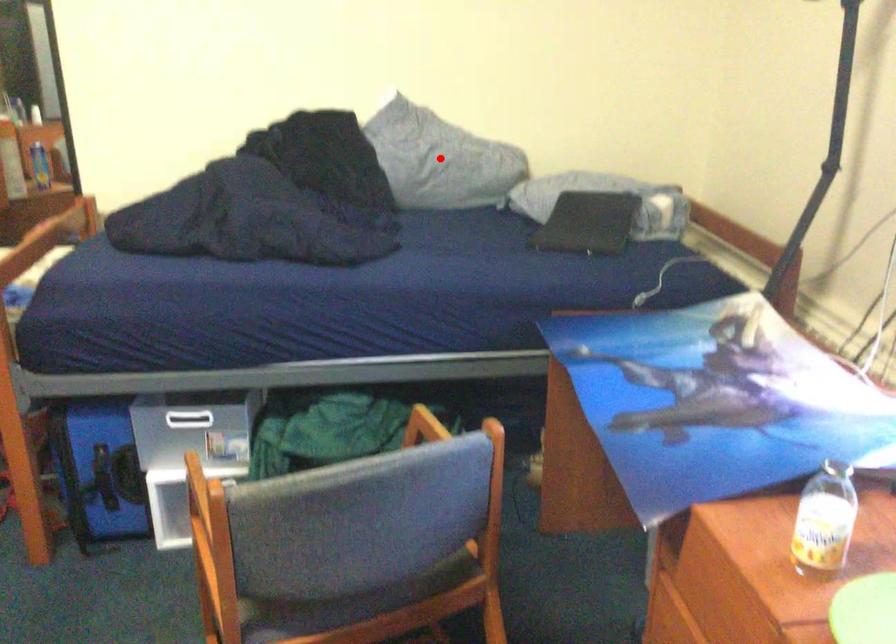
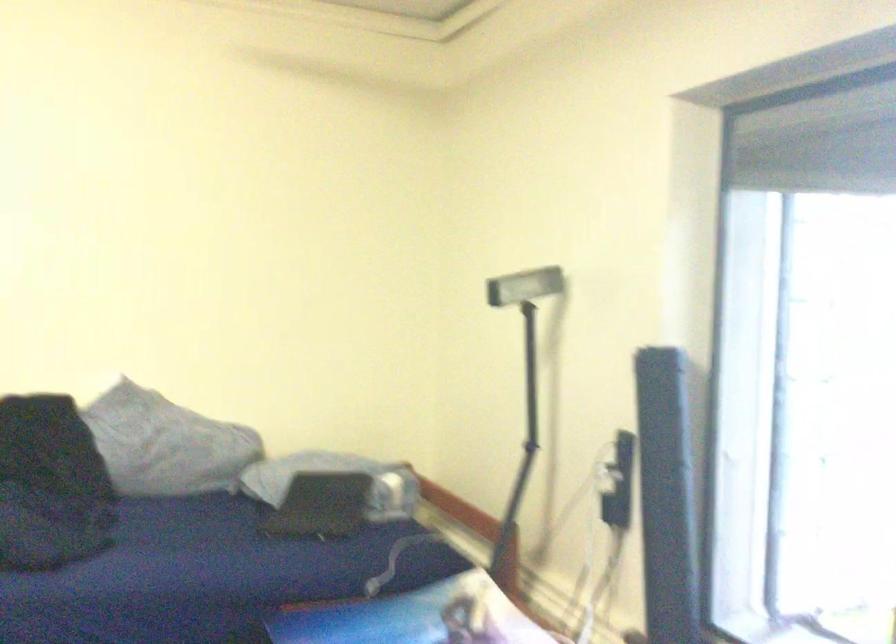
Find the pixel in the second image that matches the highlighted location in the first image.

(166, 444)